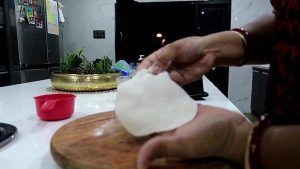
Find the location of a particular element. light switch on wall is located at coordinates (100, 36).